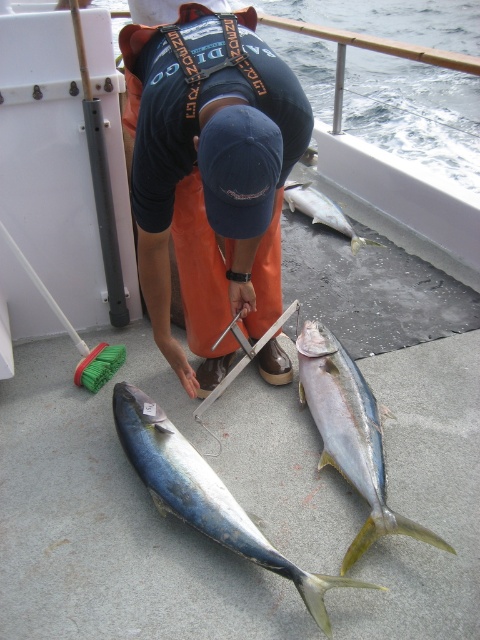
Question: Based on their relative distances, which object is nearer to the shiny yellow fish at center?

Choices:
 (A) shiny silver fish at center
 (B) orange fabric at center

Answer: (B)

Question: Based on their relative distances, which object is nearer to the shiny silver fish at center?

Choices:
 (A) shiny blue fish at center
 (B) orange fabric at center
 (C) shiny yellow fish at center

Answer: (C)

Question: Which object is the farthest from the shiny silver fish at center?

Choices:
 (A) shiny blue fish at center
 (B) orange fabric at center

Answer: (A)

Question: Can you confirm if orange fabric at center is thinner than shiny silver fish at center?

Choices:
 (A) yes
 (B) no

Answer: (B)

Question: Is orange fabric at center closer to the viewer compared to shiny blue fish at center?

Choices:
 (A) yes
 (B) no

Answer: (A)

Question: Does shiny blue fish at center lie behind shiny silver fish at center?

Choices:
 (A) no
 (B) yes

Answer: (A)